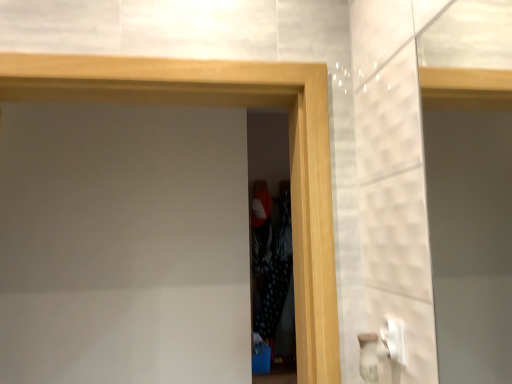
Locate an element on the screen. wooden frame at center, the second screen door viewed from the back is located at coordinates (226, 106).

This screenshot has width=512, height=384. What do you see at coordinates (226, 106) in the screenshot? I see `wooden frame at center, the second screen door viewed from the back` at bounding box center [226, 106].

In the scene shown: What is the approximate width of wooden frame at center, marked as the first screen door in a front-to-back arrangement?

wooden frame at center, marked as the first screen door in a front-to-back arrangement, is 8.67 inches in width.

The height and width of the screenshot is (384, 512). Find the location of `black dotted fabric at center, acting as the 1th screen door starting from the back`. black dotted fabric at center, acting as the 1th screen door starting from the back is located at coordinates (271, 237).

What do you see at coordinates (271, 237) in the screenshot? This screenshot has height=384, width=512. I see `black dotted fabric at center, the second screen door viewed from the front` at bounding box center [271, 237].

Measure the distance between point (x=265, y=152) and camera.

A distance of 11.08 feet exists between point (x=265, y=152) and camera.

What are the coordinates of `wooden frame at center, marked as the first screen door in a front-to-back arrangement` in the screenshot? It's located at (226, 106).

Based on their positions, is wooden frame at center, marked as the first screen door in a front-to-back arrangement, located to the left or right of black dotted fabric at center, the second screen door viewed from the front?

From the image, it's evident that wooden frame at center, marked as the first screen door in a front-to-back arrangement, is to the left of black dotted fabric at center, the second screen door viewed from the front.

Which object is closer to the camera taking this photo, wooden frame at center, the second screen door viewed from the back, or black dotted fabric at center, the second screen door viewed from the front?

wooden frame at center, the second screen door viewed from the back, is in front.

Which point is more distant from viewer, (58,68) or (272,215)?

The point (272,215) is more distant.

From the image's perspective, between wooden frame at center, the second screen door viewed from the back, and black dotted fabric at center, the second screen door viewed from the front, who is located below?

black dotted fabric at center, the second screen door viewed from the front.

From a real-world perspective, is wooden frame at center, marked as the first screen door in a front-to-back arrangement, under black dotted fabric at center, the second screen door viewed from the front?

Incorrect, from a real-world perspective, wooden frame at center, marked as the first screen door in a front-to-back arrangement, is higher than black dotted fabric at center, the second screen door viewed from the front.

In terms of width, does wooden frame at center, marked as the first screen door in a front-to-back arrangement, look wider or thinner when compared to black dotted fabric at center, acting as the 1th screen door starting from the back?

wooden frame at center, marked as the first screen door in a front-to-back arrangement, is wider than black dotted fabric at center, acting as the 1th screen door starting from the back.

Is wooden frame at center, the second screen door viewed from the back, taller or shorter than black dotted fabric at center, the second screen door viewed from the front?

Considering their sizes, wooden frame at center, the second screen door viewed from the back, has less height than black dotted fabric at center, the second screen door viewed from the front.

Looking at the image, does wooden frame at center, marked as the first screen door in a front-to-back arrangement, seem bigger or smaller compared to black dotted fabric at center, acting as the 1th screen door starting from the back?

Considering their sizes, wooden frame at center, marked as the first screen door in a front-to-back arrangement, takes up more space than black dotted fabric at center, acting as the 1th screen door starting from the back.

Is black dotted fabric at center, the second screen door viewed from the front, a part of wooden frame at center, marked as the first screen door in a front-to-back arrangement?

No, black dotted fabric at center, the second screen door viewed from the front, is located outside of wooden frame at center, marked as the first screen door in a front-to-back arrangement.

Does wooden frame at center, marked as the first screen door in a front-to-back arrangement, touch black dotted fabric at center, acting as the 1th screen door starting from the back?

wooden frame at center, marked as the first screen door in a front-to-back arrangement, is not next to black dotted fabric at center, acting as the 1th screen door starting from the back, and they're not touching.

Is wooden frame at center, marked as the first screen door in a front-to-back arrangement, facing away from black dotted fabric at center, the second screen door viewed from the front?

That's right, wooden frame at center, marked as the first screen door in a front-to-back arrangement, is facing away from black dotted fabric at center, the second screen door viewed from the front.

Can you tell me how much wooden frame at center, marked as the first screen door in a front-to-back arrangement, and black dotted fabric at center, acting as the 1th screen door starting from the back, differ in facing direction?

3.47 degrees separate the facing orientations of wooden frame at center, marked as the first screen door in a front-to-back arrangement, and black dotted fabric at center, acting as the 1th screen door starting from the back.

Measure the distance between wooden frame at center, the second screen door viewed from the back, and black dotted fabric at center, acting as the 1th screen door starting from the back.

wooden frame at center, the second screen door viewed from the back, is 1.98 meters away from black dotted fabric at center, acting as the 1th screen door starting from the back.

In the image, there is a wooden frame at center, the second screen door viewed from the back. What are the coordinates of `screen door below it (from a real-world perspective)` in the screenshot? It's located at click(271, 237).

Visually, is black dotted fabric at center, the second screen door viewed from the front, positioned to the left or to the right of wooden frame at center, marked as the first screen door in a front-to-back arrangement?

In the image, black dotted fabric at center, the second screen door viewed from the front, appears on the right side of wooden frame at center, marked as the first screen door in a front-to-back arrangement.

Based on the photo, does black dotted fabric at center, acting as the 1th screen door starting from the back, lie behind wooden frame at center, marked as the first screen door in a front-to-back arrangement?

That is True.

Is point (286, 178) positioned after point (326, 120)?

Yes, point (286, 178) is farther from viewer.

From the image's perspective, would you say black dotted fabric at center, the second screen door viewed from the front, is positioned over wooden frame at center, marked as the first screen door in a front-to-back arrangement?

No, from the image's perspective, black dotted fabric at center, the second screen door viewed from the front, is not over wooden frame at center, marked as the first screen door in a front-to-back arrangement.

From a real-world perspective, which object rests below the other?

From a 3D spatial view, black dotted fabric at center, acting as the 1th screen door starting from the back, is below.

Based on the photo, considering the sizes of objects black dotted fabric at center, acting as the 1th screen door starting from the back, and wooden frame at center, marked as the first screen door in a front-to-back arrangement, in the image provided, who is wider, black dotted fabric at center, acting as the 1th screen door starting from the back, or wooden frame at center, marked as the first screen door in a front-to-back arrangement,?

wooden frame at center, marked as the first screen door in a front-to-back arrangement, is wider.

Can you confirm if black dotted fabric at center, the second screen door viewed from the front, is taller than wooden frame at center, marked as the first screen door in a front-to-back arrangement?

Yes.

From the picture: In terms of size, does black dotted fabric at center, the second screen door viewed from the front, appear bigger or smaller than wooden frame at center, the second screen door viewed from the back?

Clearly, black dotted fabric at center, the second screen door viewed from the front, is smaller in size than wooden frame at center, the second screen door viewed from the back.

Would you say wooden frame at center, marked as the first screen door in a front-to-back arrangement, is part of black dotted fabric at center, acting as the 1th screen door starting from the back,'s contents?

No, wooden frame at center, marked as the first screen door in a front-to-back arrangement, is located outside of black dotted fabric at center, acting as the 1th screen door starting from the back.

Is black dotted fabric at center, the second screen door viewed from the front, not close to wooden frame at center, marked as the first screen door in a front-to-back arrangement?

Yes, black dotted fabric at center, the second screen door viewed from the front, and wooden frame at center, marked as the first screen door in a front-to-back arrangement, are quite far apart.

Based on the photo, is black dotted fabric at center, the second screen door viewed from the front, turned away from wooden frame at center, the second screen door viewed from the back?

black dotted fabric at center, the second screen door viewed from the front, does not have its back to wooden frame at center, the second screen door viewed from the back.

How different are the orientations of black dotted fabric at center, the second screen door viewed from the front, and wooden frame at center, the second screen door viewed from the back, in degrees?

3.47 degrees separate the facing orientations of black dotted fabric at center, the second screen door viewed from the front, and wooden frame at center, the second screen door viewed from the back.

The width and height of the screenshot is (512, 384). I want to click on screen door that is behind the wooden frame at center, the second screen door viewed from the back, so click(271, 237).

At what (x,y) coordinates should I click in order to perform the action: click on screen door in front of the black dotted fabric at center, the second screen door viewed from the front. Please return your answer as a coordinate pair (x, y). Image resolution: width=512 pixels, height=384 pixels. Looking at the image, I should click on (226, 106).

Find the location of a particular element. The image size is (512, 384). screen door that appears on the right of wooden frame at center, the second screen door viewed from the back is located at coordinates (271, 237).